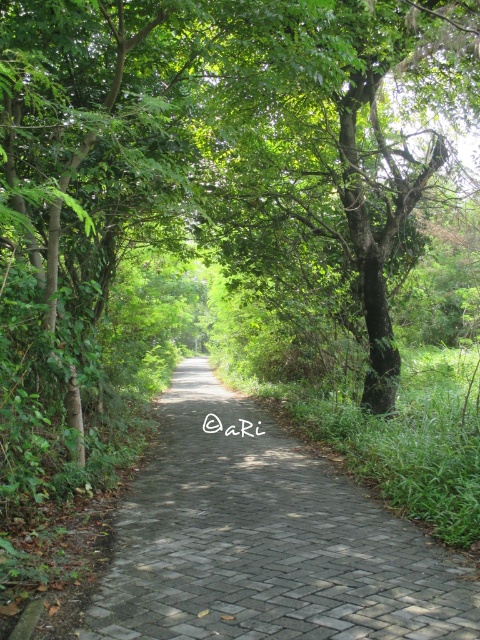
Is green leafy tree at center taller than paved stone path at center?

Indeed, green leafy tree at center has a greater height compared to paved stone path at center.

Between point (338, 224) and point (187, 420), which one is positioned behind?

The point (187, 420) is behind.

What do you see at coordinates (212, 170) in the screenshot? I see `green leafy tree at center` at bounding box center [212, 170].

The height and width of the screenshot is (640, 480). Identify the location of green leafy tree at center. (212, 170).